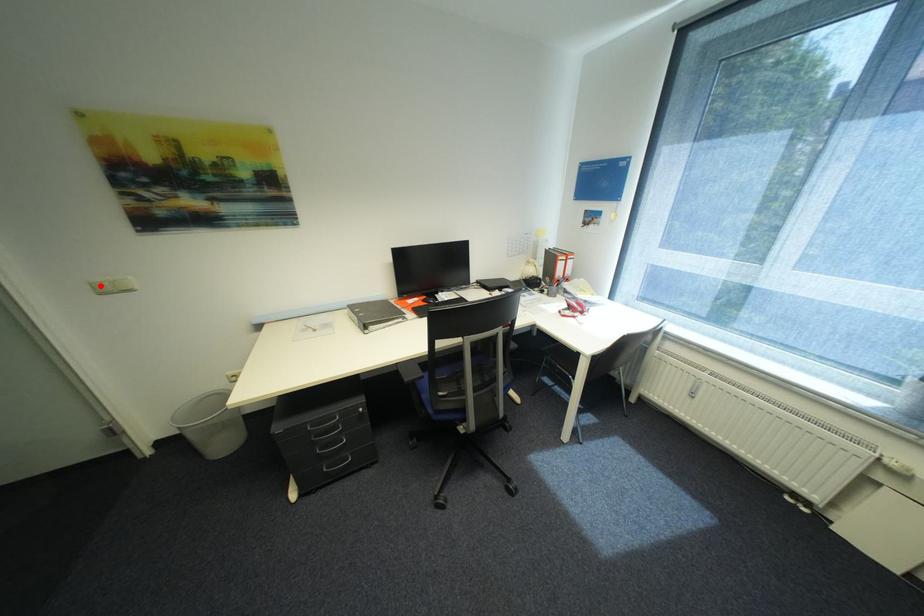
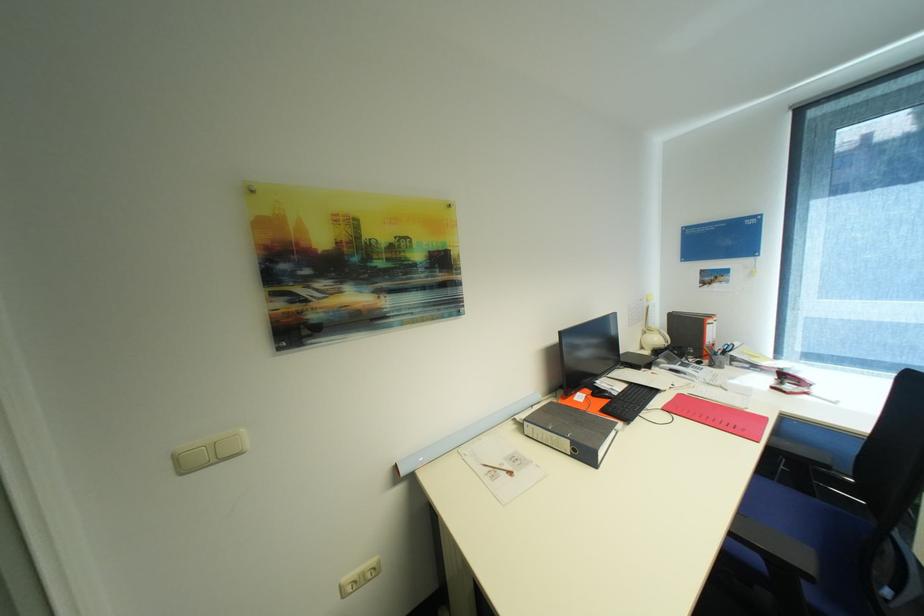
Where in the second image is the point corresponding to the highlighted location from the first image?

(185, 458)